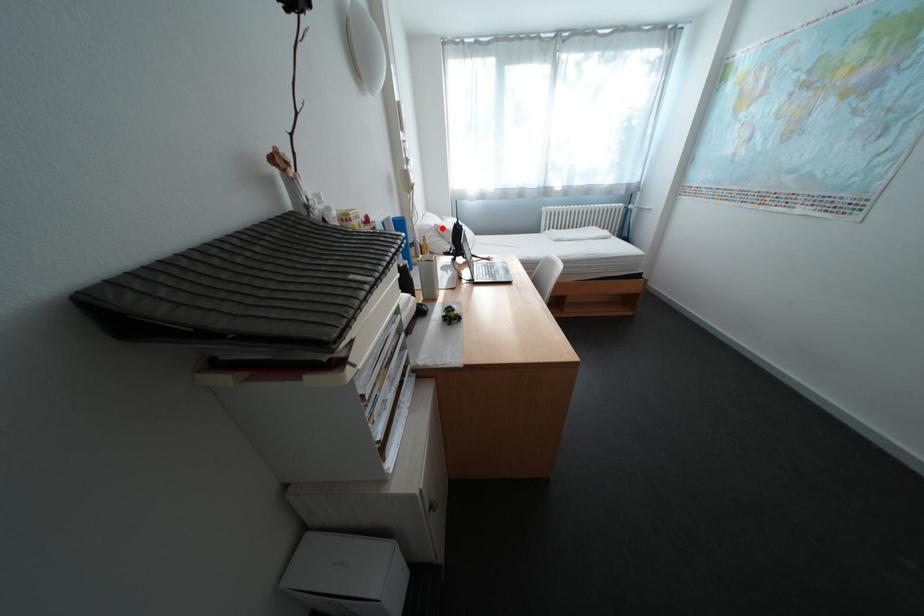
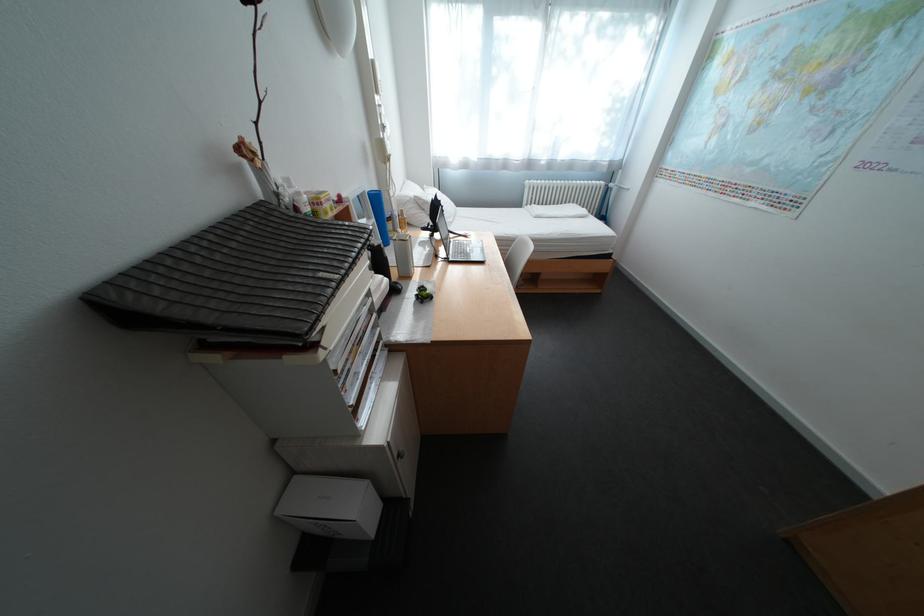
Question: I am providing you with two images of the same scene from different viewpoints. A red point is shown in image1. For the corresponding object point in image2, is it positioned nearer or farther from the camera?

Choices:
 (A) Nearer
 (B) Farther

Answer: (B)